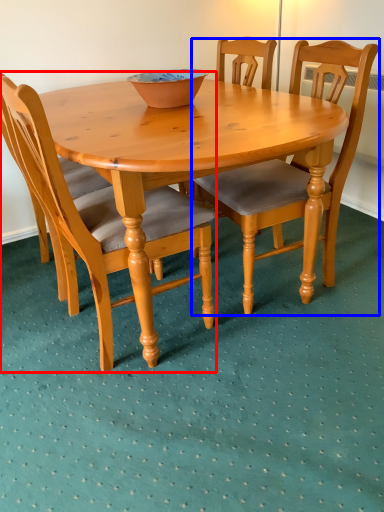
Question: Which of the following is the farthest to the observer, chair (highlighted by a red box) or chair (highlighted by a blue box)?

Choices:
 (A) chair
 (B) chair

Answer: (B)